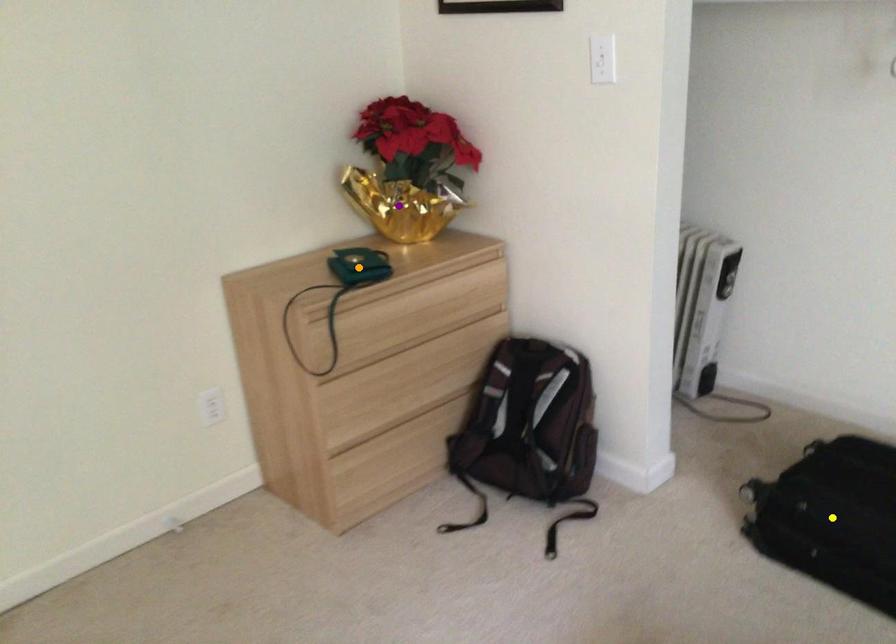
Order these from nearest to farthest:
A) yellow point
B) purple point
C) orange point

1. yellow point
2. orange point
3. purple point